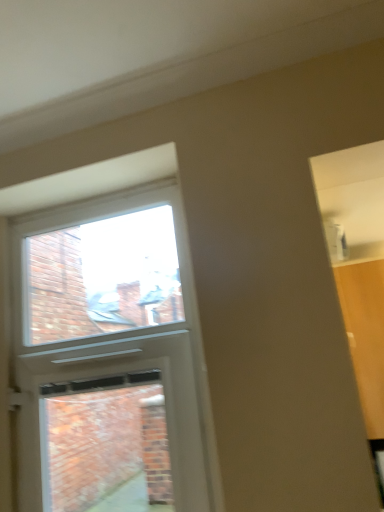
Question: From a real-world perspective, is clear glass window at upper center above or below white plastic screen door at upper left?

Choices:
 (A) above
 (B) below

Answer: (A)

Question: Which is correct: clear glass window at upper center is inside white plastic screen door at upper left, or outside of it?

Choices:
 (A) inside
 (B) outside

Answer: (B)

Question: Considering the positions of clear glass window at upper center and white plastic screen door at upper left in the image, is clear glass window at upper center bigger or smaller than white plastic screen door at upper left?

Choices:
 (A) big
 (B) small

Answer: (B)

Question: Considering the positions of white plastic screen door at upper left and clear glass window at upper center in the image, is white plastic screen door at upper left taller or shorter than clear glass window at upper center?

Choices:
 (A) tall
 (B) short

Answer: (A)

Question: Is point click(36, 442) closer or farther from the camera than point click(173, 237)?

Choices:
 (A) farther
 (B) closer

Answer: (B)

Question: From the image's perspective, is white plastic screen door at upper left located above or below clear glass window at upper center?

Choices:
 (A) above
 (B) below

Answer: (B)

Question: Relative to clear glass window at upper center, is white plastic screen door at upper left in front or behind?

Choices:
 (A) front
 (B) behind

Answer: (A)